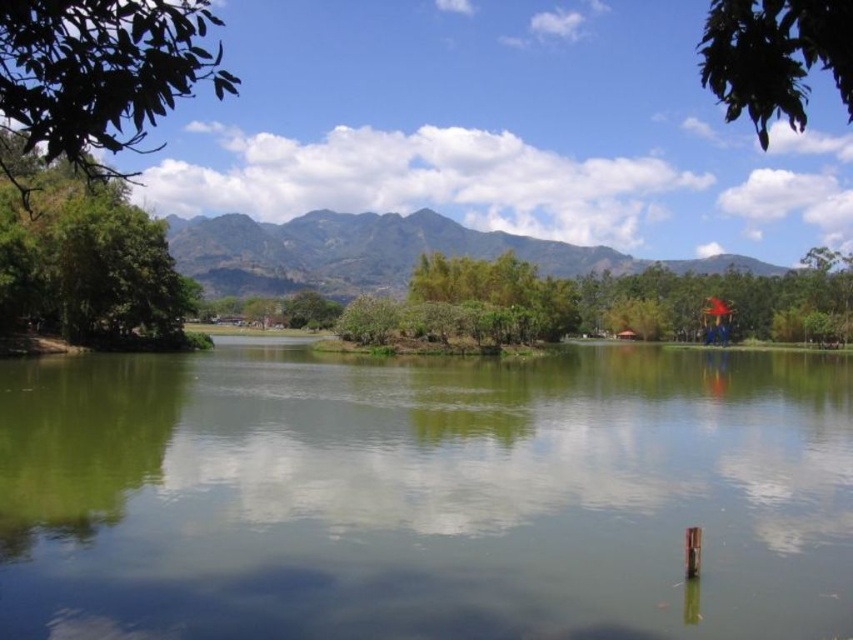
You are standing at point (84, 259) in the serene natural landscape. What object is located exactly at your current position?

The green leafy tree at left is located exactly at point (84, 259).

You are standing at the edge of the green reflective water at center and want to walk towards the green leafy tree at upper left. Which direction should you head?

The green leafy tree at upper left is located to the upper left of the green reflective water at center, so you should head towards the upper left direction.